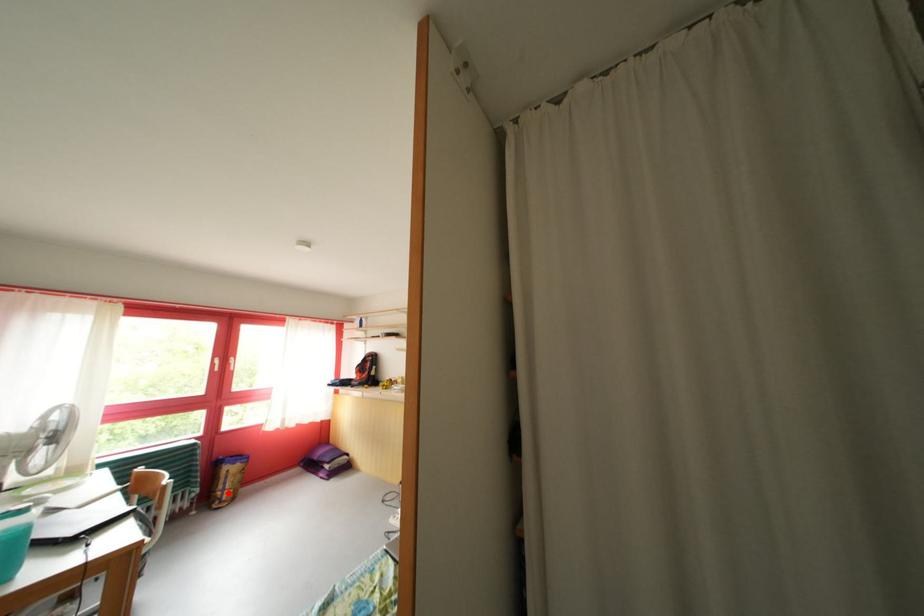
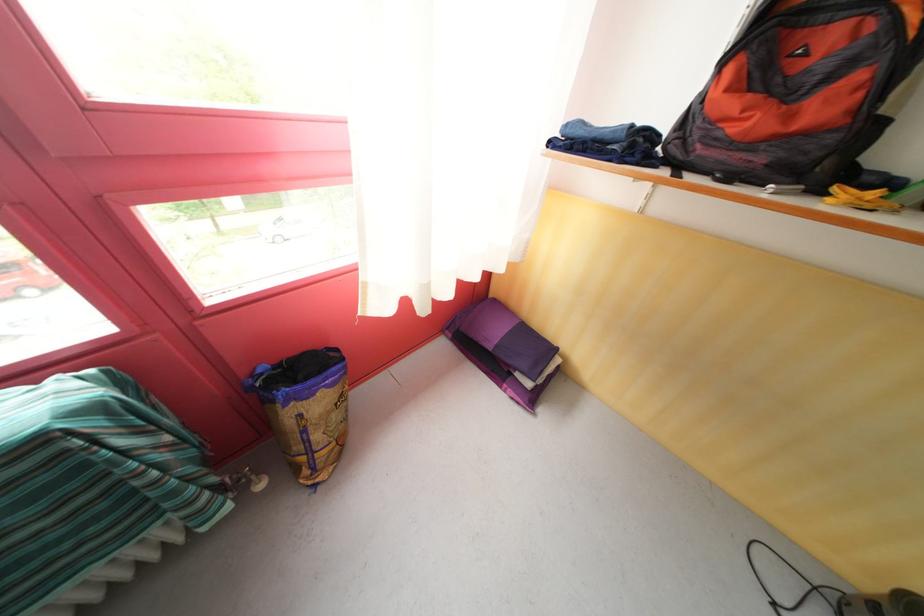
In the second image, find the point that corresponds to the highlighted location in the first image.

(305, 454)